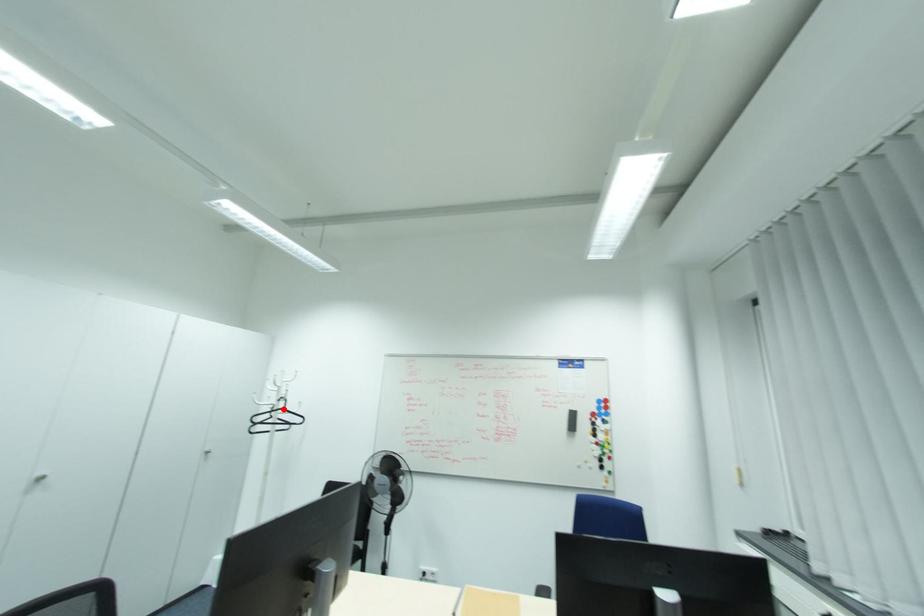
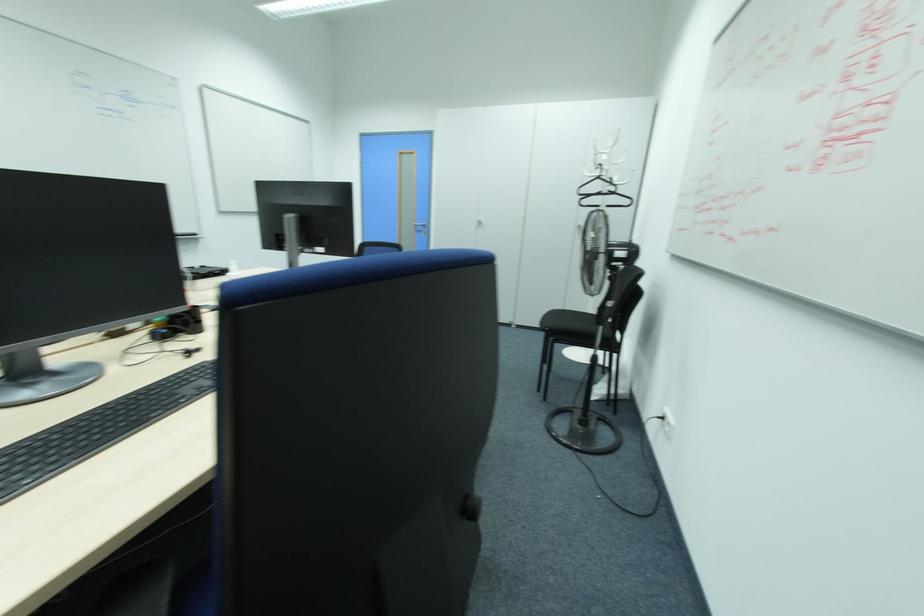
Question: A red point is marked in image1. In image2, is the corresponding 3D point closer to the camera or farther? Reply with the corresponding letter.

Choices:
 (A) The corresponding 3D point is closer.
 (B) The corresponding 3D point is farther.

Answer: (A)